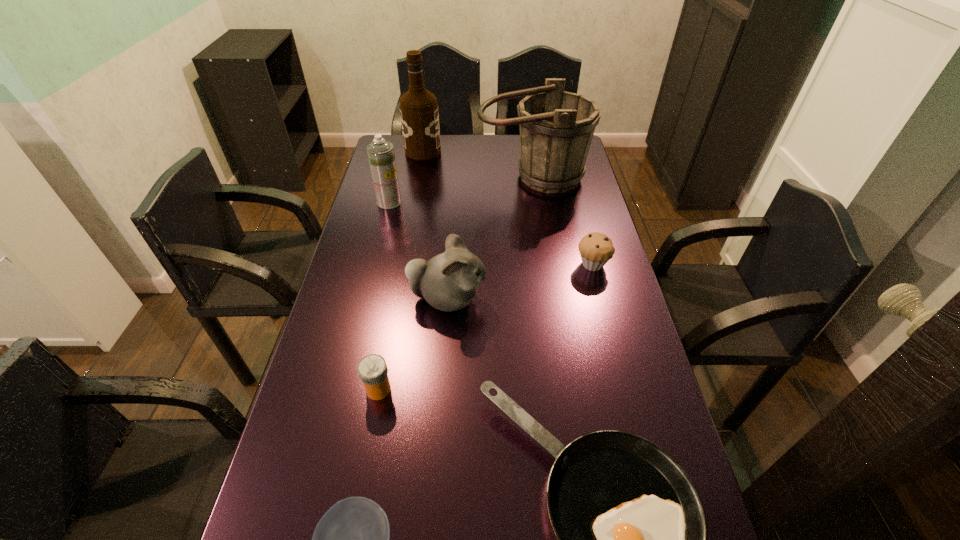
Where is `vacant space located 0.190m on the face of the fifth farthest object`? This screenshot has height=540, width=960. vacant space located 0.190m on the face of the fifth farthest object is located at coordinates (553, 299).

Identify the location of vacant space located on the front of the muffin. Image resolution: width=960 pixels, height=540 pixels. (613, 345).

Identify the location of vacant space located 0.390m on the label side of the medicine. This screenshot has width=960, height=540. (557, 389).

At what (x,y) coordinates should I click in order to perform the action: click on alcohol positioned at the far edge. Please return your answer as a coordinate pair (x, y). This screenshot has height=540, width=960. Looking at the image, I should click on (419, 114).

Where is `bucket that is at the far edge`? The height and width of the screenshot is (540, 960). bucket that is at the far edge is located at coordinates (556, 127).

Image resolution: width=960 pixels, height=540 pixels. In order to click on alcohol that is at the left edge in this screenshot , I will do `click(419, 114)`.

At what (x,y) coordinates should I click in order to perform the action: click on aerosol can that is at the left edge. Please return your answer as a coordinate pair (x, y). This screenshot has width=960, height=540. Looking at the image, I should click on (380, 152).

Identify the location of medicine present at the left edge. Image resolution: width=960 pixels, height=540 pixels. (372, 369).

This screenshot has width=960, height=540. Identify the location of bucket at the right edge. (556, 127).

Find the location of `muffin that is positioned at the right edge`. muffin that is positioned at the right edge is located at coordinates click(x=596, y=249).